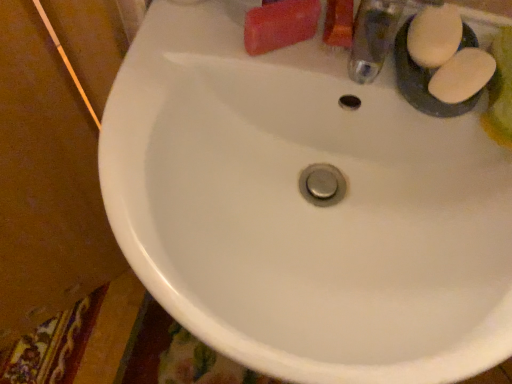
Measure the distance between matte pink bar of soap at upper right, placed as the third soap when sorted from right to left, and camera.

17.02 inches.

Locate an element on the screen. The width and height of the screenshot is (512, 384). white matte soap at upper right, which appears as the 2th soap when viewed from the right is located at coordinates (434, 36).

Where is `matte pink bar of soap at upper right, placed as the third soap when sorted from right to left`? Image resolution: width=512 pixels, height=384 pixels. matte pink bar of soap at upper right, placed as the third soap when sorted from right to left is located at coordinates (280, 25).

From the image's perspective, between white matte soap at upper right, which is the 2th soap in left-to-right order, and matte pink bar of soap at upper right, placed as the third soap when sorted from right to left, which one is located above?

matte pink bar of soap at upper right, placed as the third soap when sorted from right to left, from the image's perspective.

Is there a large distance between white matte soap at upper right, which is the 2th soap in left-to-right order, and matte pink bar of soap at upper right, placed as the third soap when sorted from right to left?

No, white matte soap at upper right, which is the 2th soap in left-to-right order, is not far from matte pink bar of soap at upper right, placed as the third soap when sorted from right to left.

Which object is positioned more to the left, white matte soap at upper right, which is the 2th soap in left-to-right order, or matte pink bar of soap at upper right, placed as the third soap when sorted from right to left?

Positioned to the left is matte pink bar of soap at upper right, placed as the third soap when sorted from right to left.

From a real-world perspective, is white matte soap at upper right, which appears as the 2th soap when viewed from the right, physically above matte pink bar of soap at upper right, which ranks as the first soap in left-to-right order?

No, from a real-world perspective, white matte soap at upper right, which appears as the 2th soap when viewed from the right, is not on top of matte pink bar of soap at upper right, which ranks as the first soap in left-to-right order.

Considering the relative sizes of white matte soap at upper right, which appears as the third soap when viewed from the left, and white matte soap at upper right, which appears as the 2th soap when viewed from the right, in the image provided, is white matte soap at upper right, which appears as the third soap when viewed from the left, wider than white matte soap at upper right, which appears as the 2th soap when viewed from the right,?

No.

Is white matte soap at upper right, which is counted as the first soap, starting from the right, surrounding white matte soap at upper right, which appears as the 2th soap when viewed from the right?

Actually, white matte soap at upper right, which appears as the 2th soap when viewed from the right, is outside white matte soap at upper right, which is counted as the first soap, starting from the right.

Considering the positions of points (467, 81) and (453, 47), is point (467, 81) closer to camera compared to point (453, 47)?

That is True.

Which of these two, white matte soap at upper right, which is the 2th soap in left-to-right order, or white matte soap at upper right, which is counted as the first soap, starting from the right, is smaller?

white matte soap at upper right, which is counted as the first soap, starting from the right, is smaller.

Does white matte soap at upper right, which appears as the 2th soap when viewed from the right, lie behind white matte soap at upper right, which appears as the third soap when viewed from the left?

Yes.

Is white matte soap at upper right, which appears as the 2th soap when viewed from the right, spatially inside white matte soap at upper right, which is counted as the first soap, starting from the right, or outside of it?

white matte soap at upper right, which appears as the 2th soap when viewed from the right, is not enclosed by white matte soap at upper right, which is counted as the first soap, starting from the right.

Does point (455, 40) appear closer or farther from the camera than point (454, 56)?

Clearly, point (455, 40) is more distant from the camera than point (454, 56).

Can you confirm if white matte soap at upper right, which is counted as the first soap, starting from the right, is wider than matte pink bar of soap at upper right, which ranks as the first soap in left-to-right order?

In fact, white matte soap at upper right, which is counted as the first soap, starting from the right, might be narrower than matte pink bar of soap at upper right, which ranks as the first soap in left-to-right order.

What's the angular difference between white matte soap at upper right, which appears as the third soap when viewed from the left, and matte pink bar of soap at upper right, placed as the third soap when sorted from right to left,'s facing directions?

49.8 degrees separate the facing orientations of white matte soap at upper right, which appears as the third soap when viewed from the left, and matte pink bar of soap at upper right, placed as the third soap when sorted from right to left.

Where is `soap that is the 2nd object located in front of the matte pink bar of soap at upper right, placed as the third soap when sorted from right to left`? The image size is (512, 384). soap that is the 2nd object located in front of the matte pink bar of soap at upper right, placed as the third soap when sorted from right to left is located at coordinates (462, 76).

Is white matte soap at upper right, which is counted as the first soap, starting from the right, a part of matte pink bar of soap at upper right, placed as the third soap when sorted from right to left?

No, white matte soap at upper right, which is counted as the first soap, starting from the right, is not surrounded by matte pink bar of soap at upper right, placed as the third soap when sorted from right to left.

Is matte pink bar of soap at upper right, which ranks as the first soap in left-to-right order, not close to white matte soap at upper right, which appears as the third soap when viewed from the left?

They are positioned close to each other.

Which of these two, matte pink bar of soap at upper right, placed as the third soap when sorted from right to left, or white matte soap at upper right, which appears as the third soap when viewed from the left, is wider?

With larger width is matte pink bar of soap at upper right, placed as the third soap when sorted from right to left.

Considering the sizes of objects matte pink bar of soap at upper right, placed as the third soap when sorted from right to left, and white matte soap at upper right, which is counted as the first soap, starting from the right, in the image provided, who is smaller, matte pink bar of soap at upper right, placed as the third soap when sorted from right to left, or white matte soap at upper right, which is counted as the first soap, starting from the right,?

Smaller between the two is white matte soap at upper right, which is counted as the first soap, starting from the right.

Is matte pink bar of soap at upper right, placed as the third soap when sorted from right to left, situated inside white matte soap at upper right, which is the 2th soap in left-to-right order, or outside?

The correct answer is: outside.

Can you tell me how much matte pink bar of soap at upper right, placed as the third soap when sorted from right to left, and white matte soap at upper right, which appears as the 2th soap when viewed from the right, differ in facing direction?

The angle between the facing direction of matte pink bar of soap at upper right, placed as the third soap when sorted from right to left, and the facing direction of white matte soap at upper right, which appears as the 2th soap when viewed from the right, is 49.8 degrees.

Is matte pink bar of soap at upper right, placed as the third soap when sorted from right to left, far from white matte soap at upper right, which appears as the 2th soap when viewed from the right?

matte pink bar of soap at upper right, placed as the third soap when sorted from right to left, is actually quite close to white matte soap at upper right, which appears as the 2th soap when viewed from the right.

Where is `soap above the white matte soap at upper right, which is the 2th soap in left-to-right order (from a real-world perspective)`? The height and width of the screenshot is (384, 512). soap above the white matte soap at upper right, which is the 2th soap in left-to-right order (from a real-world perspective) is located at coordinates (280, 25).

I want to click on soap below the white matte soap at upper right, which appears as the 2th soap when viewed from the right (from the image's perspective), so click(462, 76).

Estimate the real-world distances between objects in this image. Which object is further from white matte soap at upper right, which is the 2th soap in left-to-right order, matte pink bar of soap at upper right, which ranks as the first soap in left-to-right order, or white matte soap at upper right, which appears as the third soap when viewed from the left?

matte pink bar of soap at upper right, which ranks as the first soap in left-to-right order, lies further to white matte soap at upper right, which is the 2th soap in left-to-right order, than the other object.

Looking at this image, considering their positions, is white matte soap at upper right, which is counted as the first soap, starting from the right, positioned further to white matte soap at upper right, which appears as the 2th soap when viewed from the right, than matte pink bar of soap at upper right, placed as the third soap when sorted from right to left?

matte pink bar of soap at upper right, placed as the third soap when sorted from right to left, lies further to white matte soap at upper right, which appears as the 2th soap when viewed from the right, than the other object.

From the image, which object appears to be farther from white matte soap at upper right, which appears as the third soap when viewed from the left, white matte soap at upper right, which appears as the 2th soap when viewed from the right, or matte pink bar of soap at upper right, placed as the third soap when sorted from right to left?

matte pink bar of soap at upper right, placed as the third soap when sorted from right to left, is positioned further to the anchor white matte soap at upper right, which appears as the third soap when viewed from the left.

Based on their spatial positions, is white matte soap at upper right, which is the 2th soap in left-to-right order, or white matte soap at upper right, which appears as the third soap when viewed from the left, further from matte pink bar of soap at upper right, which ranks as the first soap in left-to-right order?

white matte soap at upper right, which appears as the third soap when viewed from the left, is further to matte pink bar of soap at upper right, which ranks as the first soap in left-to-right order.

Estimate the real-world distances between objects in this image. Which object is further from white matte soap at upper right, which is counted as the first soap, starting from the right, matte pink bar of soap at upper right, which ranks as the first soap in left-to-right order, or white matte soap at upper right, which appears as the 2th soap when viewed from the right?

matte pink bar of soap at upper right, which ranks as the first soap in left-to-right order.

Which object lies further to the anchor point matte pink bar of soap at upper right, placed as the third soap when sorted from right to left, white matte soap at upper right, which is counted as the first soap, starting from the right, or white matte soap at upper right, which is the 2th soap in left-to-right order?

Among the two, white matte soap at upper right, which is counted as the first soap, starting from the right, is located further to matte pink bar of soap at upper right, placed as the third soap when sorted from right to left.

Image resolution: width=512 pixels, height=384 pixels. I want to click on soap between matte pink bar of soap at upper right, which ranks as the first soap in left-to-right order, and white matte soap at upper right, which is counted as the first soap, starting from the right, in the horizontal direction, so click(x=434, y=36).